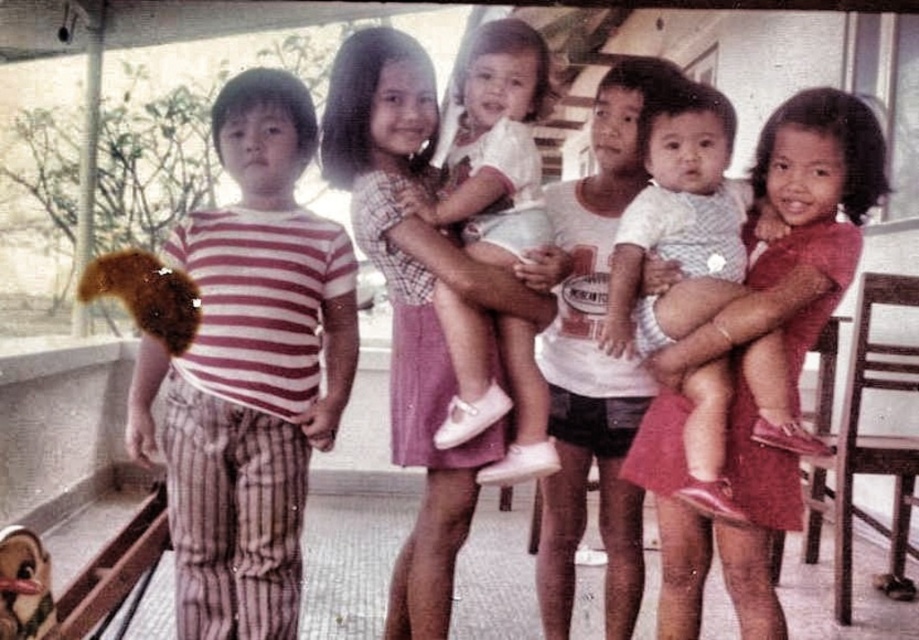
You are a photographer trying to capture a group photo of the striped fabric shirt at left and the white cotton shirt at center. Since you want to ensure both are in the frame, which direction should you position your camera relative to the subjects?

The striped fabric shirt at left is positioned on the left side of the white cotton shirt at center, so you should position your camera to the left of the subjects to include both in the frame.